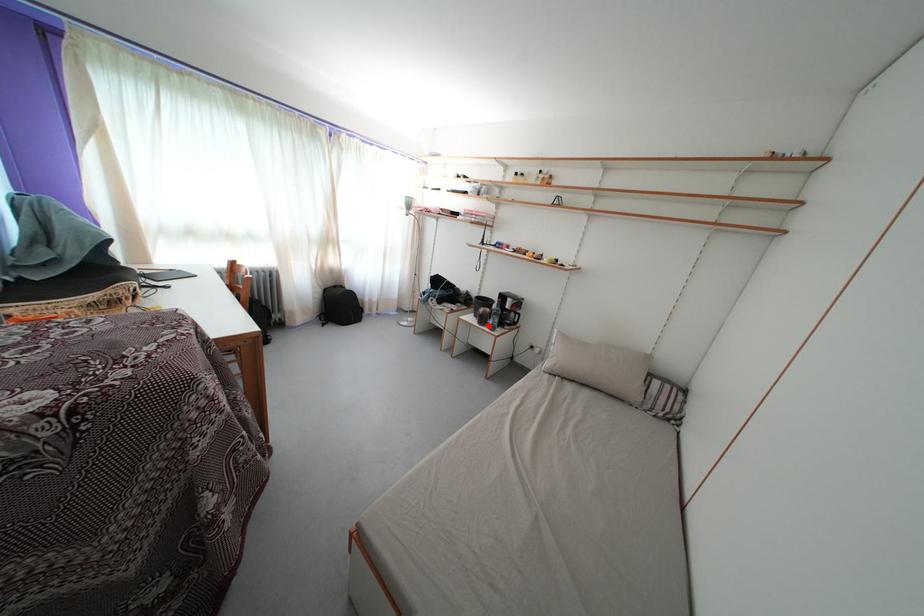
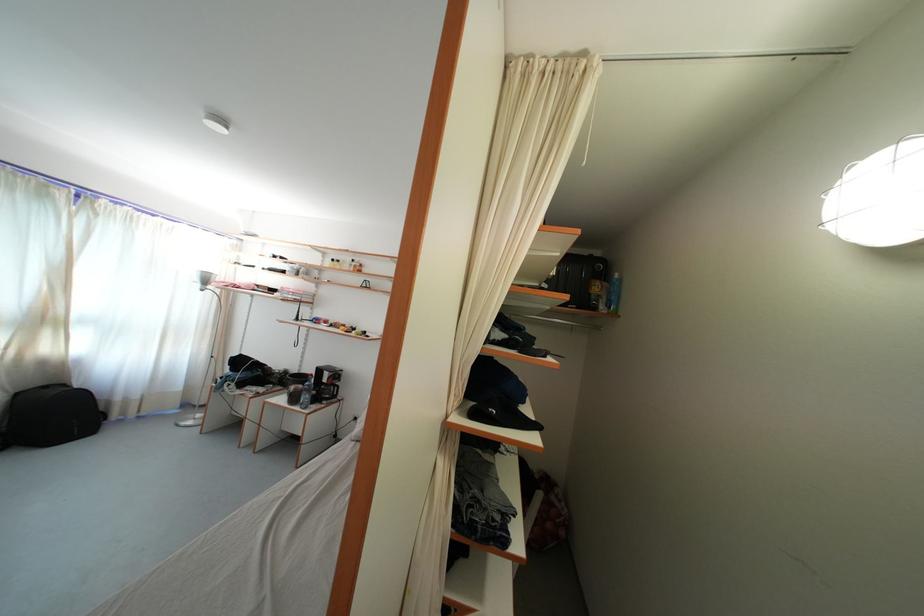
Where in the second image is the point corresponding to the highlighted location from the first image?

(300, 405)